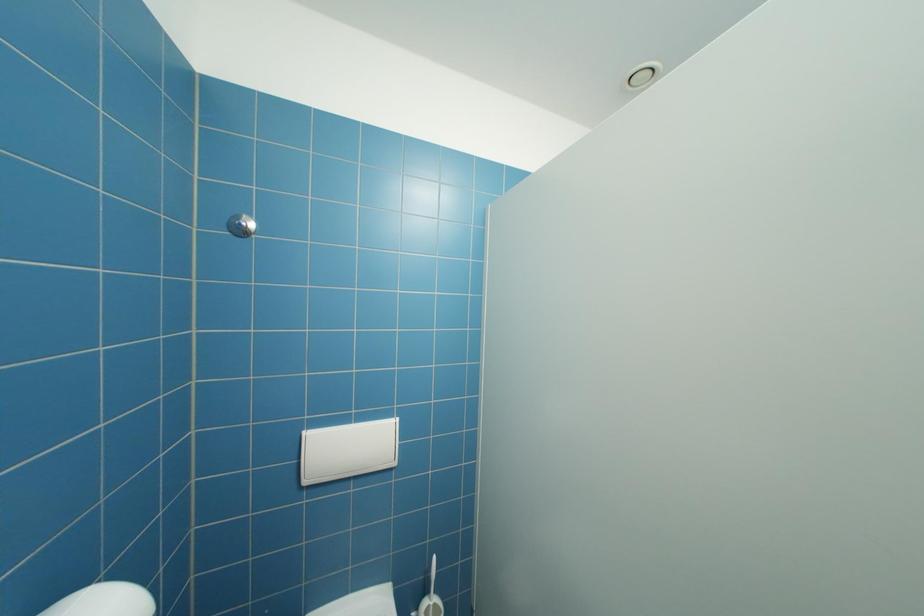
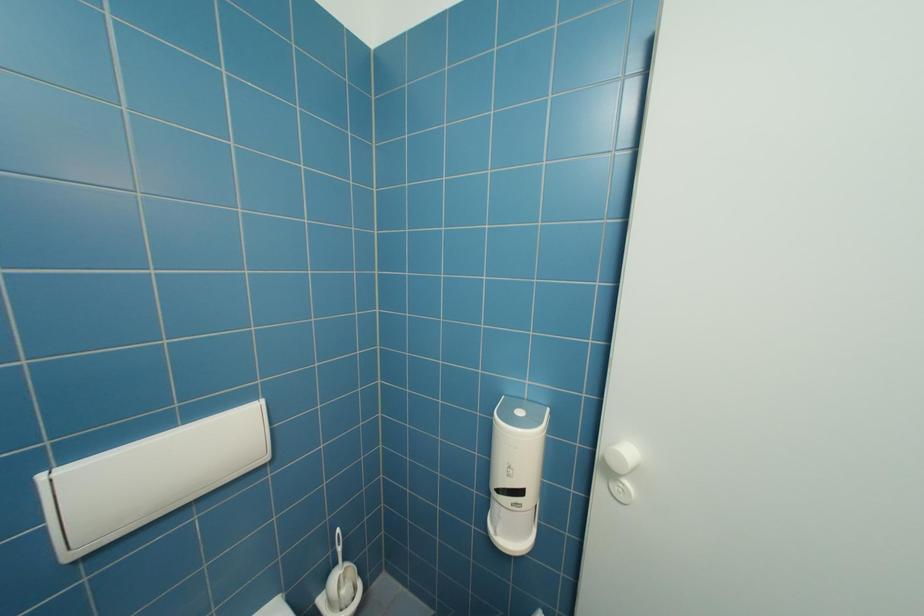
Question: Based on the continuous images, in which direction is the camera rotating? Reply with the corresponding letter.

Choices:
 (A) Left
 (B) Right
 (C) Up
 (D) Down

Answer: (B)